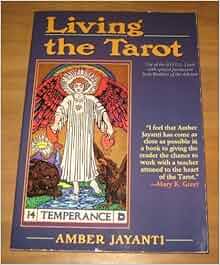
Where is `book`? book is located at coordinates pyautogui.click(x=151, y=93).